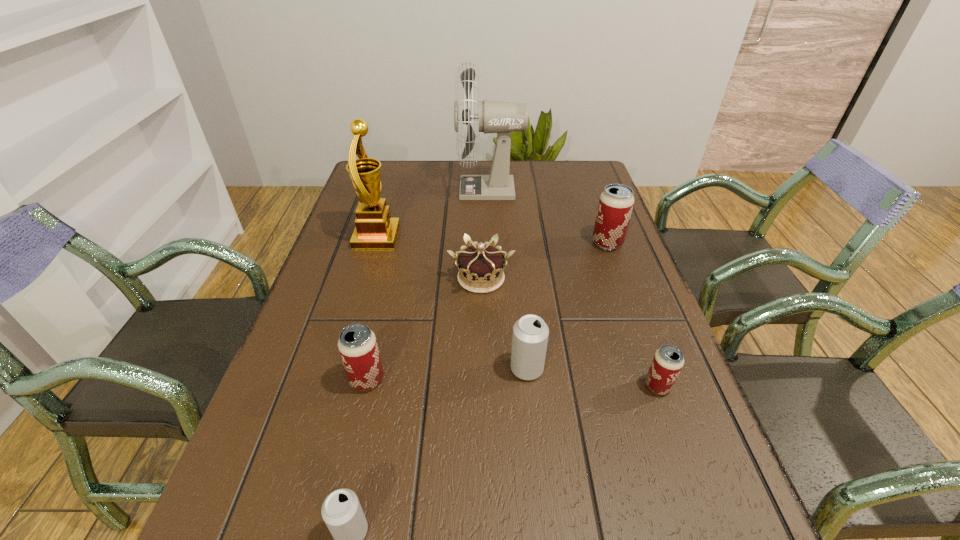
The height and width of the screenshot is (540, 960). I want to click on object that is at the far edge, so click(499, 117).

Locate an element on the screen. This screenshot has width=960, height=540. award that is at the left edge is located at coordinates (374, 228).

The height and width of the screenshot is (540, 960). Find the location of `beer can that is at the left edge`. beer can that is at the left edge is located at coordinates (357, 344).

Locate an element on the screen. This screenshot has height=540, width=960. free space at the far edge of the desktop is located at coordinates (474, 175).

In the image, there is a desktop. Identify the location of free space at the left edge. (299, 372).

The height and width of the screenshot is (540, 960). Identify the location of vacant region at the right edge of the desktop. [642, 489].

Locate an element on the screen. free space at the far left corner of the desktop is located at coordinates (402, 168).

Locate an element on the screen. This screenshot has width=960, height=540. free space at the far right corner is located at coordinates (565, 181).

Locate an element on the screen. The image size is (960, 540). vacant area that lies between the award and the second smallest red beer can is located at coordinates (372, 308).

Where is `free space between the fan and the smallest red beer can`? This screenshot has height=540, width=960. free space between the fan and the smallest red beer can is located at coordinates (574, 288).